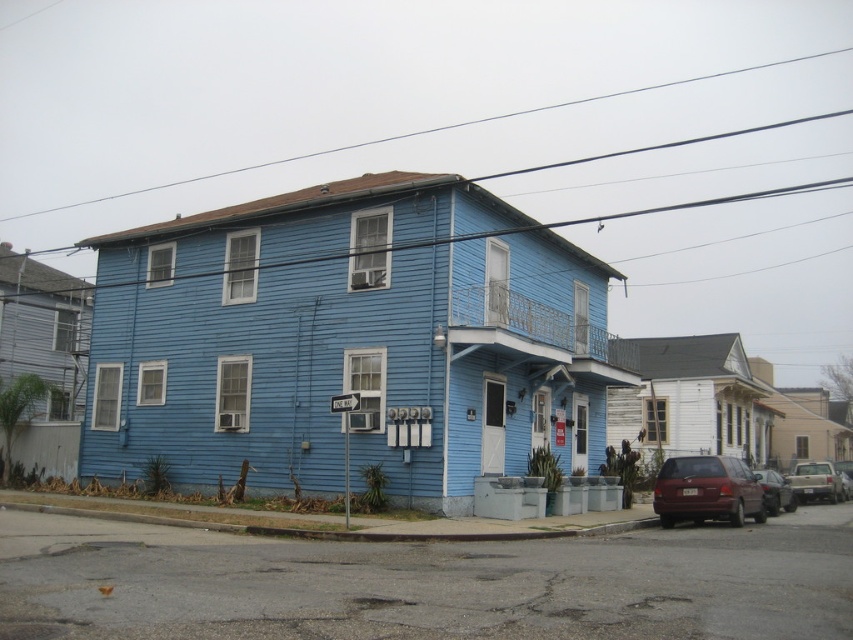
You are a delivery person trying to park your 6.5 feet tall delivery truck in front of the ONE WAY street sign. You see a matte maroon van at lower right and a silver metallic suv at lower right. Which vehicle is shorter and can allow you to park without blocking the street sign?

The matte maroon van at lower right is not as tall as the silver metallic suv at lower right, so the matte maroon van at lower right is shorter and can allow you to park without blocking the street sign.

You are a delivery person driving a van that is 5 meters long. You need to park your van between the silver metallic suv at lower right and the metallic silver car at lower right. Based on the scene, can you fit your van in the space between them?

The silver metallic suv at lower right and metallic silver car at lower right are 5.42 meters apart from each other. Since your van is 5 meters long, you can fit it in the space between them as there is enough space available.

You are a delivery driver approaching the ONE WAY street sign in front of the house. You need to park your silver metallic suv at lower right near the white wood trim at center. Can you safely park your vehicle so that it doesn not block the entrance? Explain your reasoning.

The white wood trim at center is positioned on the left side of the silver metallic suv at lower right. Since the street is one way, parking on the left side of the entrance would align with the traffic direction, allowing the suv to park without blocking the entrance.